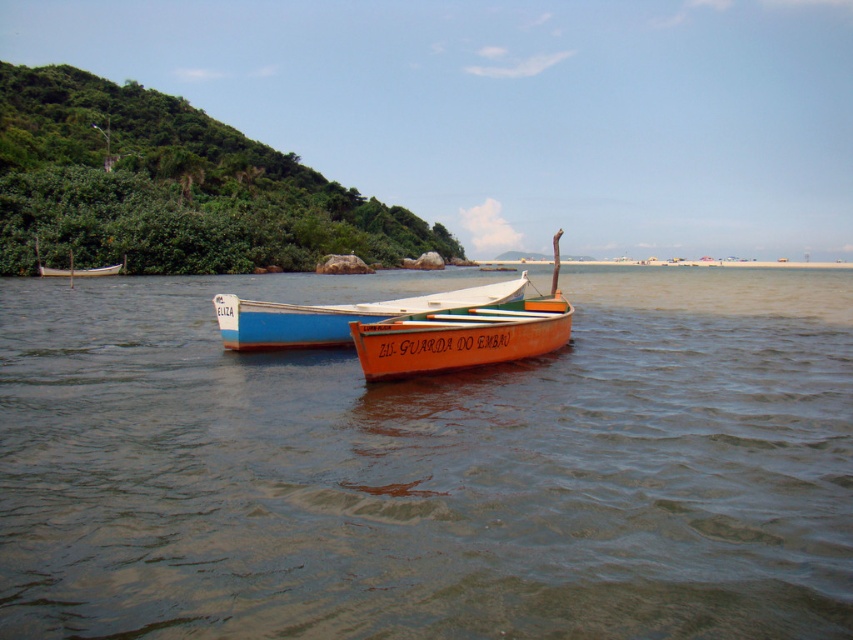
Question: Estimate the real-world distances between objects in this image. Which object is farther from the orange matte canoe at center?

Choices:
 (A) blue painted wood boat at center
 (B) brown matte water at center
 (C) white wooden boat at left

Answer: (C)

Question: Which point is farther to the camera?

Choices:
 (A) brown matte water at center
 (B) white wooden boat at left

Answer: (B)

Question: Does brown matte water at center have a lesser width compared to blue painted wood boat at center?

Choices:
 (A) no
 (B) yes

Answer: (A)

Question: From the image, what is the correct spatial relationship of orange matte canoe at center in relation to blue painted wood boat at center?

Choices:
 (A) right
 (B) left

Answer: (A)

Question: Where is brown matte water at center located in relation to orange matte canoe at center in the image?

Choices:
 (A) below
 (B) above

Answer: (B)

Question: Which of the following is the farthest from the observer?

Choices:
 (A) blue painted wood boat at center
 (B) brown matte water at center

Answer: (A)